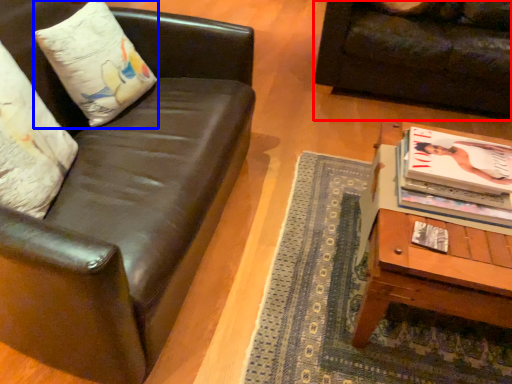
Question: Which of the following is the closest to the observer, studio couch (highlighted by a red box) or pillow (highlighted by a blue box)?

Choices:
 (A) studio couch
 (B) pillow

Answer: (B)